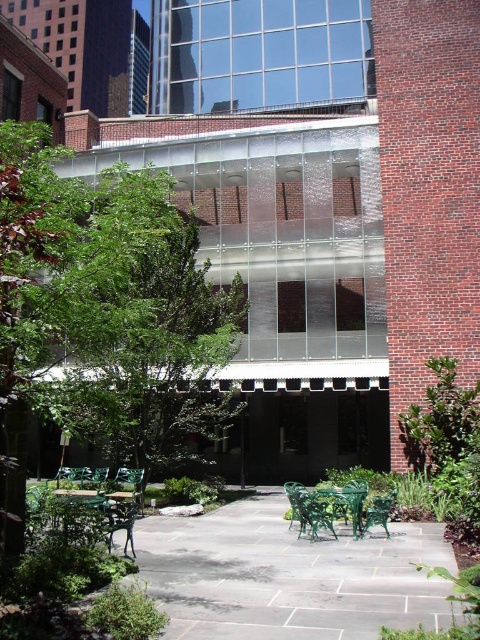
Question: Can you confirm if green leafy tree at center is positioned below green metal table at lower left?

Choices:
 (A) no
 (B) yes

Answer: (A)

Question: Which point is farther from the camera taking this photo?

Choices:
 (A) (113, 305)
 (B) (417, 536)

Answer: (B)

Question: Which object is the closest to the green leafy tree at center?

Choices:
 (A) green metal park bench at center
 (B) green metal table at lower left

Answer: (B)

Question: Does green leafy tree at center appear on the left side of green metal table at lower left?

Choices:
 (A) no
 (B) yes

Answer: (B)

Question: Estimate the real-world distances between objects in this image. Which object is farther from the green metal table at lower left?

Choices:
 (A) green metal park bench at center
 (B) green leafy tree at center

Answer: (B)

Question: Is green leafy tree at center to the right of green metal table at lower left from the viewer's perspective?

Choices:
 (A) yes
 (B) no

Answer: (B)